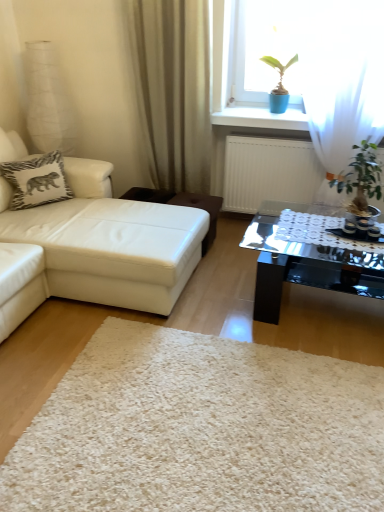
Find the location of a particular element. spots to the right of brown leather stool at center is located at coordinates (235, 245).